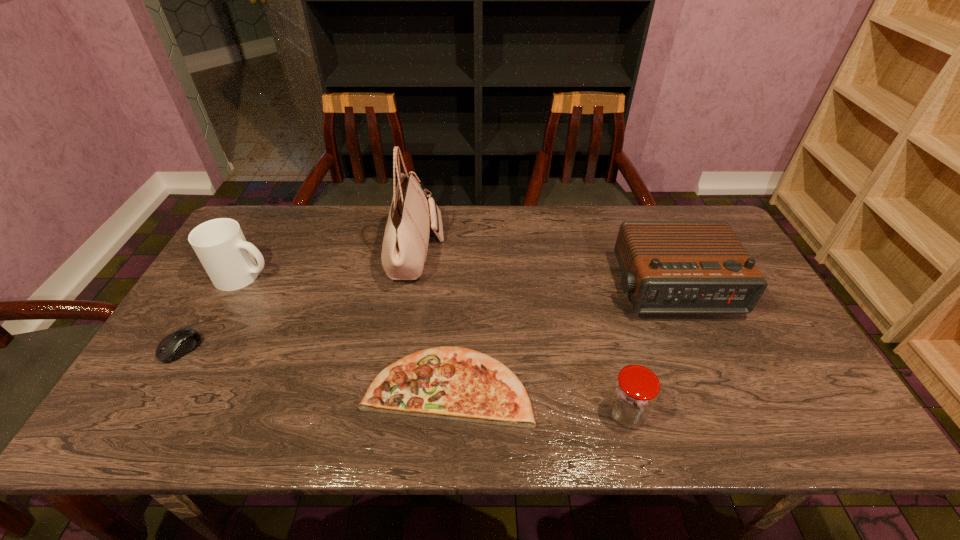
In order to click on blank space located 0.320m on the left of the fourth tallest object in this screenshot , I will do `click(464, 414)`.

Image resolution: width=960 pixels, height=540 pixels. Identify the location of free region located 0.050m on the back of the mouse. (199, 320).

What are the coordinates of `vacant point located 0.100m on the right of the pizza` in the screenshot? It's located at (574, 386).

The width and height of the screenshot is (960, 540). I want to click on object at the far edge, so click(x=405, y=244).

Find the location of a particular element. This screenshot has width=960, height=540. jar that is positioned at the near edge is located at coordinates (635, 390).

Find the location of a particular element. pizza present at the near edge is located at coordinates (454, 383).

I want to click on mug positioned at the left edge, so click(220, 245).

Identify the location of mouse at the left edge. Image resolution: width=960 pixels, height=540 pixels. (179, 343).

The image size is (960, 540). I want to click on object that is at the right edge, so click(668, 267).

Find the location of `vacant region at the far edge of the desktop`. vacant region at the far edge of the desktop is located at coordinates (519, 216).